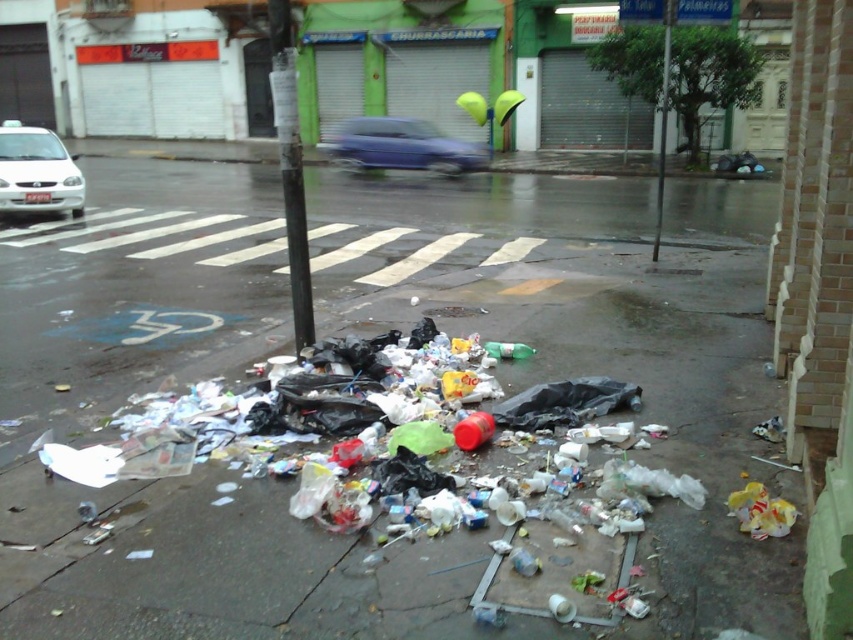
You are a delivery driver who needs to park your vehicle between the blue glossy car at center and the white matte car at left. Given that your delivery van is 6 meters long, can you safely park there without overlapping either vehicle?

The distance between the blue glossy car at center and the white matte car at left is 10.68 meters. Since the delivery van is 6 meters long, there is sufficient space to park between them without overlapping either vehicle.

You are a delivery driver needing to park your vehicle in this area. You have a white matte car at left and a blue glossy car at center. Which car is shorter in height, and why is this important for parking?

The blue glossy car at center is not as tall as the white matte car at left, so the blue glossy car at center is shorter. This is important for parking because if there are height restrictions or low clearance areas, the shorter car would be safer to maneuver without hitting obstacles.

You are a delivery person needing to park your white matte car at left. The parking spot is exactly the size of the metallic pole at center. Will your car fit in the parking spot?

The white matte car at left is bigger than the metallic pole at center, so the car will not fit in the parking spot since it is larger than the available space.